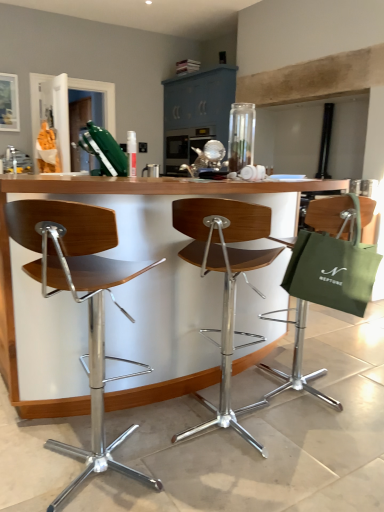
I want to click on vacant area that lies to the right of green fabric bag at right, which appears as the first chair when viewed from the right, so click(x=359, y=381).